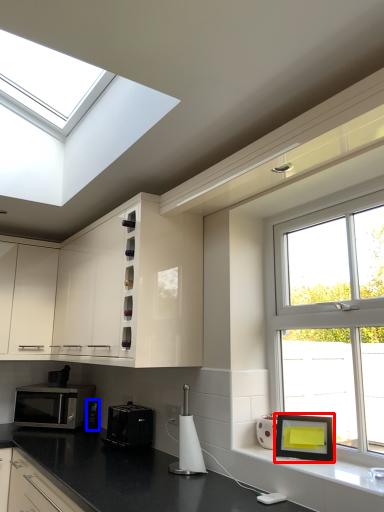
Question: Which of the following is the farthest to the observer, picture frame (highlighted by a red box) or appliance (highlighted by a blue box)?

Choices:
 (A) picture frame
 (B) appliance

Answer: (B)